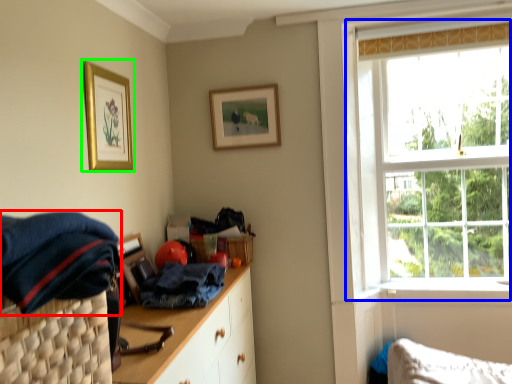
Question: Which object is the closest to the clothing (highlighted by a red box)? Choose among these: window (highlighted by a blue box) or picture frame (highlighted by a green box).

Choices:
 (A) window
 (B) picture frame

Answer: (B)